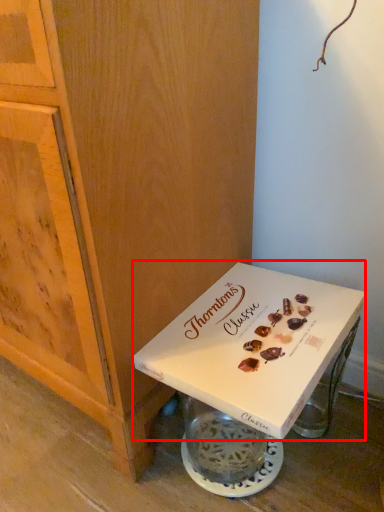
Question: Considering the relative positions of box (annotated by the red box) and cabinetry in the image provided, where is box (annotated by the red box) located with respect to the staircase?

Choices:
 (A) left
 (B) right

Answer: (B)